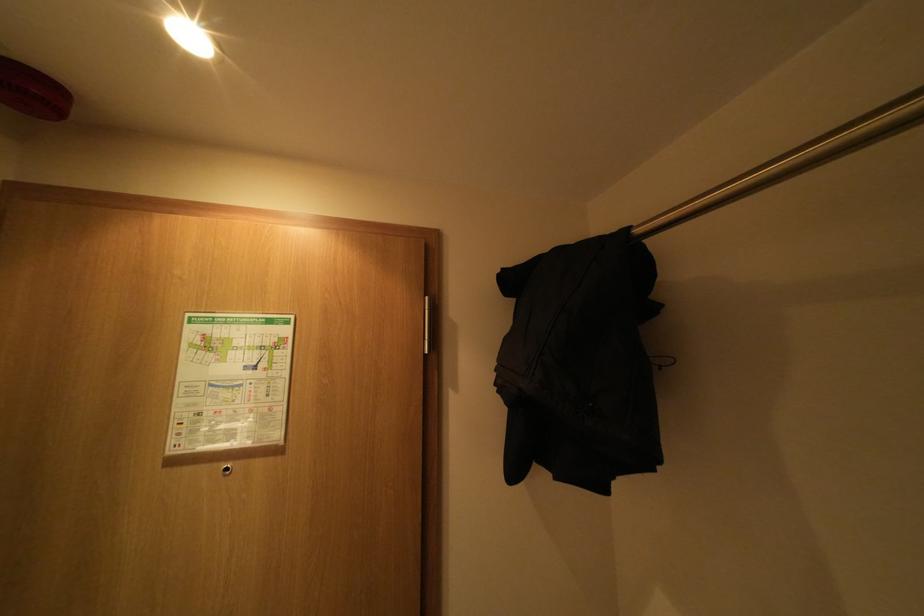
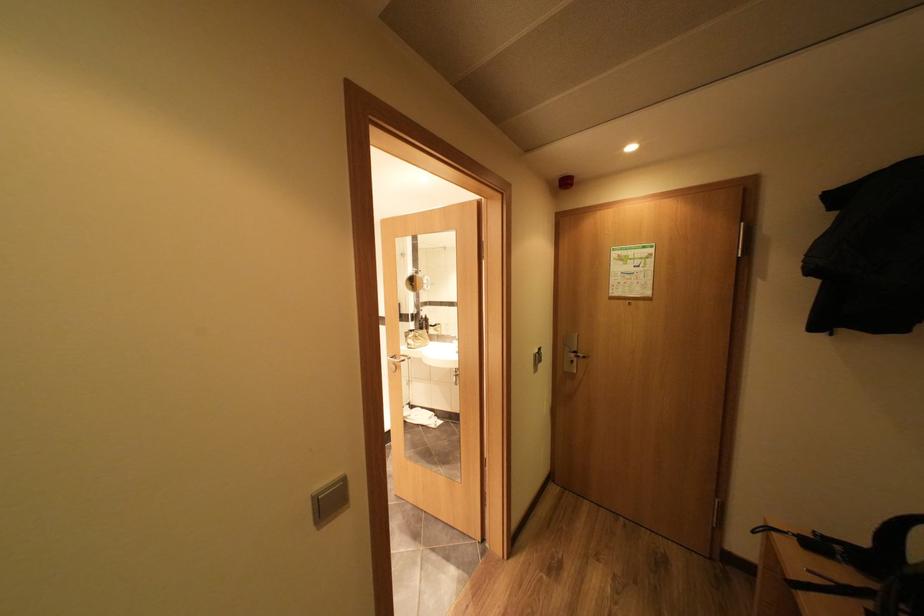
Where in the second image is the point corresponding to [198,469] from the first image?

(626, 302)